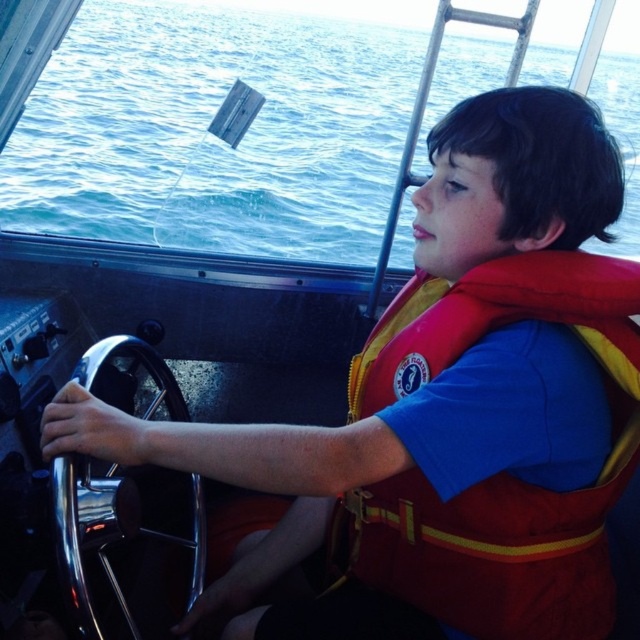
Question: Can you confirm if blue water at upper left is thinner than polished chrome steering wheel at center?

Choices:
 (A) yes
 (B) no

Answer: (B)

Question: Among these points, which one is farthest from the camera?

Choices:
 (A) (291, 26)
 (B) (93, 534)

Answer: (A)

Question: Estimate the real-world distances between objects in this image. Which object is closer to the polished chrome steering wheel at center?

Choices:
 (A) blue water at upper left
 (B) red/yellow fabric life vest at center

Answer: (B)

Question: Does red/yellow fabric life vest at center come in front of polished chrome steering wheel at center?

Choices:
 (A) no
 (B) yes

Answer: (B)

Question: Which of the following is the closest to the observer?

Choices:
 (A) pos(632,211)
 (B) pos(77,602)
 (C) pos(620,280)

Answer: (C)

Question: Does blue water at upper left appear under polished chrome steering wheel at center?

Choices:
 (A) yes
 (B) no

Answer: (B)